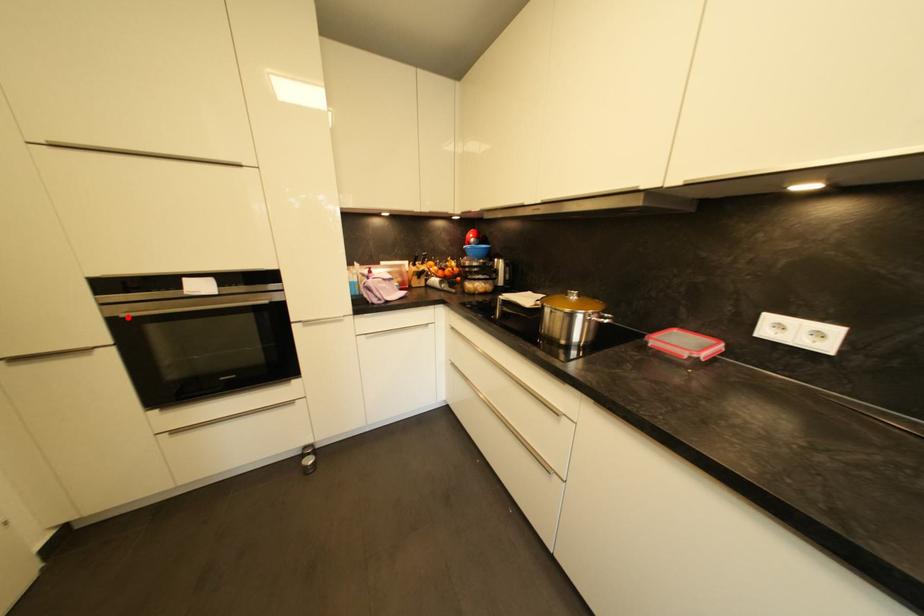
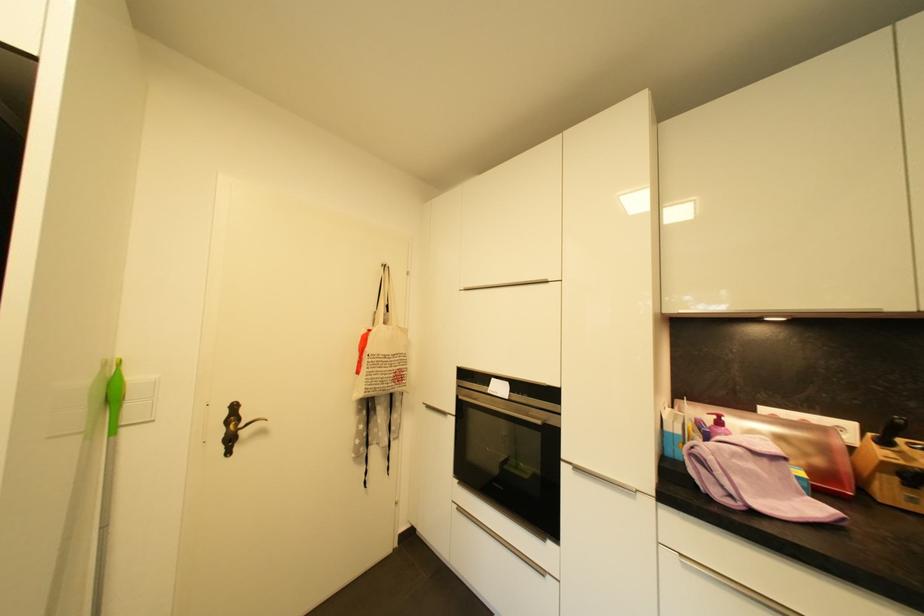
Question: I am providing you with two images of the same scene from different viewpoints. In image1, a red point is highlighted. Considering the same 3D point in image2, which of the following is correct?

Choices:
 (A) It is closer
 (B) It is farther

Answer: (B)